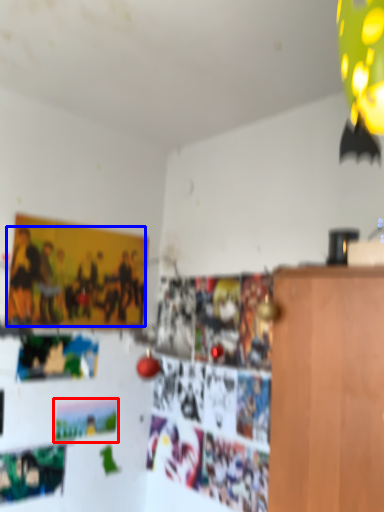
Question: Which object appears closest to the camera in this image, postcard (highlighted by a red box) or person (highlighted by a blue box)?

Choices:
 (A) postcard
 (B) person

Answer: (B)